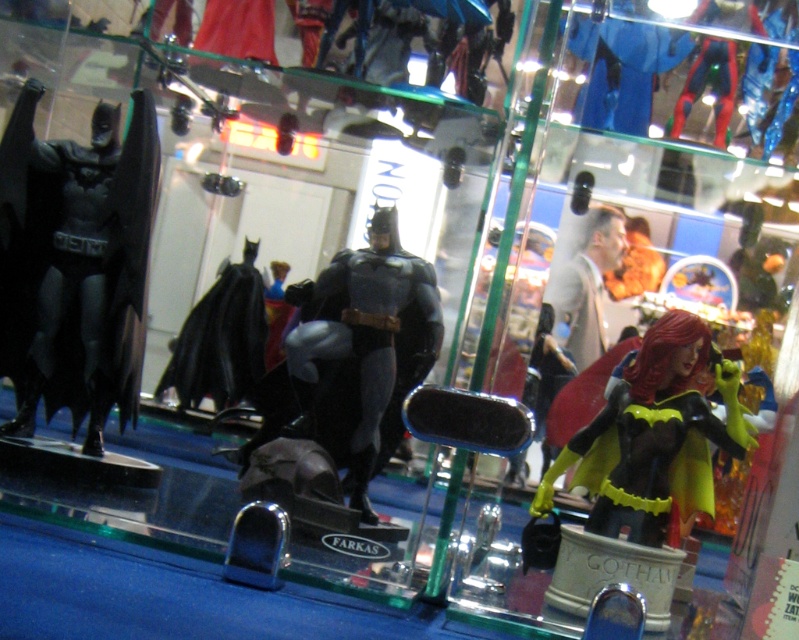
Question: Does matte black batman figure at left have a greater width compared to matte black cape at center?

Choices:
 (A) yes
 (B) no

Answer: (A)

Question: Among these points, which one is nearest to the camera?

Choices:
 (A) (252, 371)
 (B) (370, 365)
 (C) (22, 381)
 (D) (682, 356)

Answer: (D)

Question: Which object appears closest to the camera in this image?

Choices:
 (A) matte black batman figure at left
 (B) matte black batman figure at center

Answer: (A)

Question: Which of these objects is positioned farthest from the matte black batman figure at center?

Choices:
 (A) matte black batman figure at left
 (B) matte black cape at center

Answer: (A)

Question: Is matte black batman figure at center wider than matte black cape at center?

Choices:
 (A) yes
 (B) no

Answer: (A)

Question: Is matte black batman figure at center bigger than matte black cape at center?

Choices:
 (A) yes
 (B) no

Answer: (A)